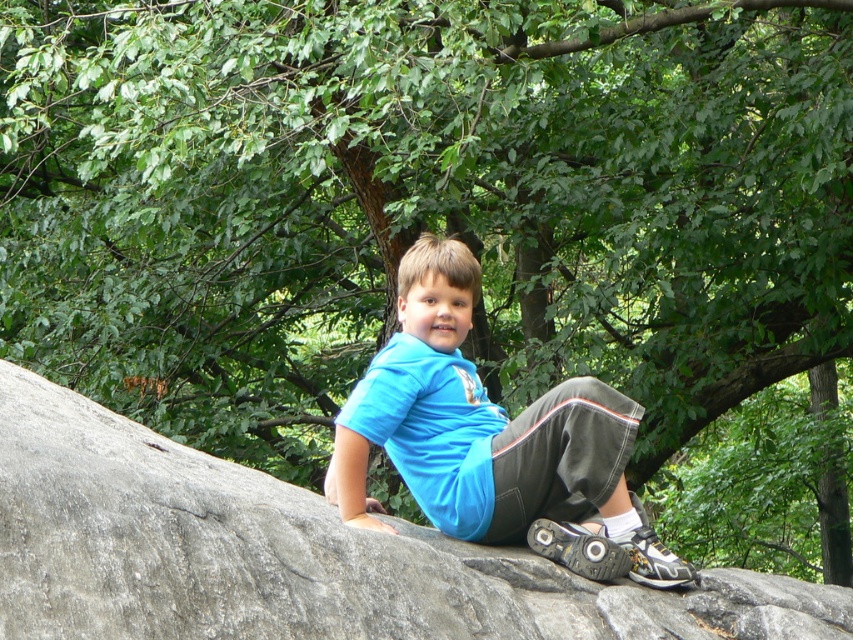
You are a photographer trying to capture the boy in the image. You want to ensure that both the gray rough rock at center and the blue fabric shirt at center are in focus. Given that your camera can only focus on objects within a 25 inch range, will both objects be in focus?

The gray rough rock at center and blue fabric shirt at center are 25.17 inches apart. Since the distance between them exceeds the camera focus range of 25 inches, both objects cannot be in focus simultaneously.

Based on the scene description, which object has a greater width when comparing the gray rough rock at center and the blue fabric shirt at center?

The gray rough rock at center has a greater width than the blue fabric shirt at center according to the description.